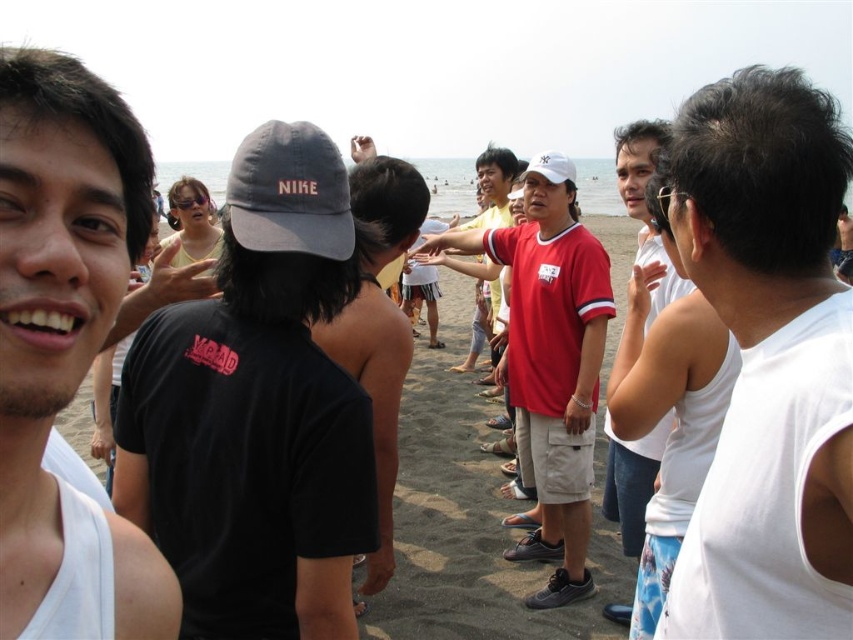
Question: In this image, where is matte gray baseball cap at center located relative to white matte baseball cap at center?

Choices:
 (A) above
 (B) below

Answer: (B)

Question: Can you confirm if black matte t-shirt at center is positioned below white matte tank top at center?

Choices:
 (A) no
 (B) yes

Answer: (B)

Question: Estimate the real-world distances between objects in this image. Which object is closer to the white matte baseball cap at center?

Choices:
 (A) red matte shirt at center
 (B) white tank top at right
 (C) white matte tank top at center

Answer: (A)

Question: Which point is closer to the camera?

Choices:
 (A) (340, 323)
 (B) (569, 385)
 (C) (550, 173)
 (D) (810, 324)

Answer: (D)

Question: Is white tank top at right in front of black matte cap at center?

Choices:
 (A) no
 (B) yes

Answer: (B)

Question: Which point is farther to the camera?

Choices:
 (A) red matte shirt at center
 (B) white matte tank top at center
 (C) white matte baseball cap at center
 (D) white tank top at right

Answer: (C)